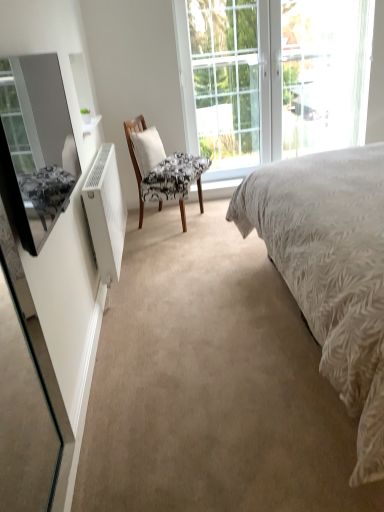
Question: Can you confirm if matte black mirror at left is positioned to the right of white textured bed at center?

Choices:
 (A) no
 (B) yes

Answer: (A)

Question: Is matte black mirror at left taller than white textured bed at center?

Choices:
 (A) yes
 (B) no

Answer: (B)

Question: From a real-world perspective, is matte black mirror at left physically above white textured bed at center?

Choices:
 (A) yes
 (B) no

Answer: (A)

Question: Could white textured bed at center be considered to be inside matte black mirror at left?

Choices:
 (A) yes
 (B) no

Answer: (B)

Question: Is matte black mirror at left closer to the viewer compared to white textured bed at center?

Choices:
 (A) no
 (B) yes

Answer: (A)

Question: Is clear glass window at upper center inside the boundaries of white matte radiator at left, or outside?

Choices:
 (A) inside
 (B) outside

Answer: (B)

Question: Considering the positions of clear glass window at upper center and white matte radiator at left in the image, is clear glass window at upper center taller or shorter than white matte radiator at left?

Choices:
 (A) tall
 (B) short

Answer: (A)

Question: Is point (188, 144) closer or farther from the camera than point (104, 203)?

Choices:
 (A) closer
 (B) farther

Answer: (B)

Question: In the image, is clear glass window at upper center positioned in front of or behind white matte radiator at left?

Choices:
 (A) behind
 (B) front

Answer: (A)

Question: From the image's perspective, is clear glass door at center above or below clear glass window at upper center?

Choices:
 (A) below
 (B) above

Answer: (A)

Question: Is clear glass door at center inside the boundaries of clear glass window at upper center, or outside?

Choices:
 (A) inside
 (B) outside

Answer: (A)

Question: From a real-world perspective, is clear glass door at center above or below clear glass window at upper center?

Choices:
 (A) above
 (B) below

Answer: (A)

Question: Is clear glass door at center in front of or behind clear glass window at upper center in the image?

Choices:
 (A) behind
 (B) front

Answer: (A)

Question: Considering the positions of point (152, 194) and point (337, 318), is point (152, 194) closer or farther from the camera than point (337, 318)?

Choices:
 (A) closer
 (B) farther

Answer: (B)

Question: From a real-world perspective, is patterned fabric chair at center above or below white textured bed at center?

Choices:
 (A) below
 (B) above

Answer: (A)